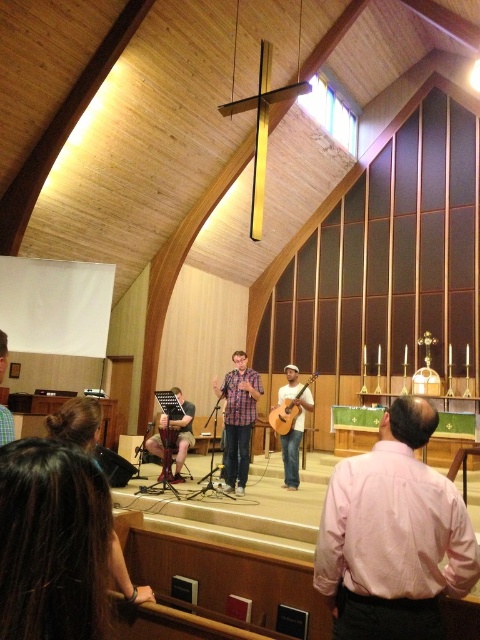
Is plaid shirt at center behind wooden planks at center?

No, plaid shirt at center is in front of wooden planks at center.

Which is below, plaid shirt at center or wooden planks at center?

Positioned lower is wooden planks at center.

Identify the location of plaid shirt at center. (238, 419).

The width and height of the screenshot is (480, 640). I want to click on plaid shirt at center, so click(238, 419).

Looking at this image, which of these two, matte white guitar at center or acoustic wood guitar at center, stands shorter?

acoustic wood guitar at center

Can you confirm if matte white guitar at center is smaller than acoustic wood guitar at center?

No.

Locate an element on the screen. The height and width of the screenshot is (640, 480). matte white guitar at center is located at coordinates (291, 420).

Is matte white guitar at center positioned before wooden planks at center?

That is True.

Between matte white guitar at center and wooden planks at center, which one has less height?

With less height is wooden planks at center.

The height and width of the screenshot is (640, 480). Find the location of `matte white guitar at center`. matte white guitar at center is located at coordinates (291, 420).